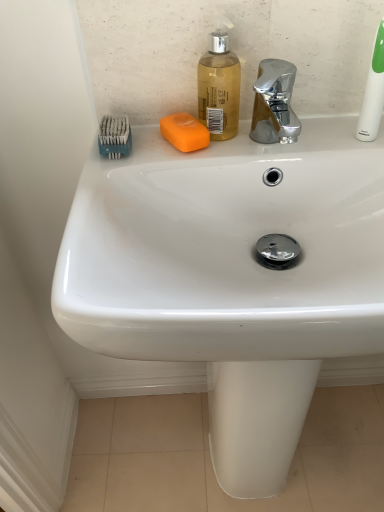
The width and height of the screenshot is (384, 512). Find the location of `free space in front of teal plastic toothbrush at upper left`. free space in front of teal plastic toothbrush at upper left is located at coordinates (114, 179).